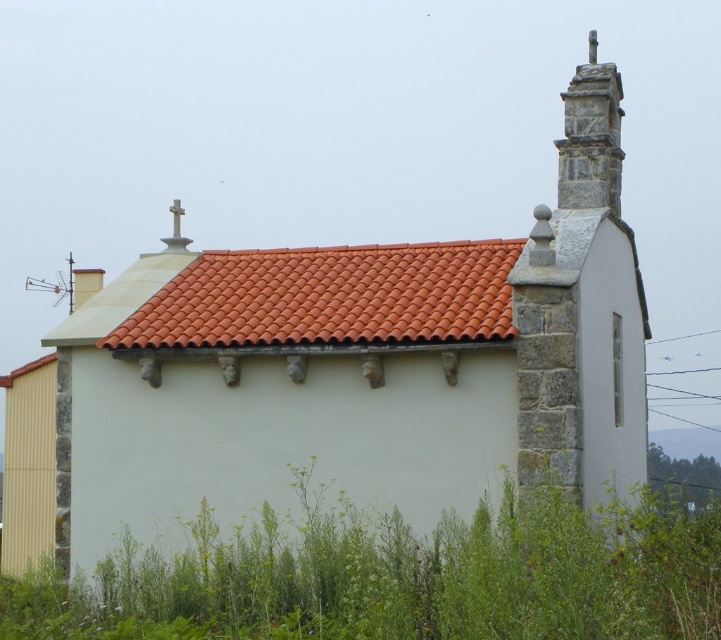
Question: Is terracotta tiles at center to the right of stone cross at upper right from the viewer's perspective?

Choices:
 (A) no
 (B) yes

Answer: (A)

Question: Can you confirm if terracotta tiles at center is smaller than stone cross at upper right?

Choices:
 (A) yes
 (B) no

Answer: (A)

Question: Which is farther from the stone cross at upper right?

Choices:
 (A) terracotta tiles at center
 (B) green grass at lower left

Answer: (B)

Question: Which is nearer to the terracotta tiles at center?

Choices:
 (A) stone cross at upper right
 (B) green grass at lower left

Answer: (A)

Question: Is green grass at lower left below stone cross at upper right?

Choices:
 (A) yes
 (B) no

Answer: (A)

Question: Which object appears closest to the camera in this image?

Choices:
 (A) stone cross at upper right
 (B) terracotta tiles at center

Answer: (B)